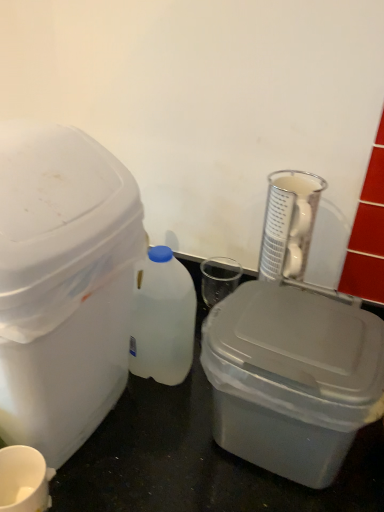
Question: From a real-world perspective, is white matte cup at lower left above or below clear glass beaker at upper right?

Choices:
 (A) below
 (B) above

Answer: (A)

Question: From the image's perspective, is white matte cup at lower left positioned above or below clear glass beaker at upper right?

Choices:
 (A) above
 (B) below

Answer: (B)

Question: Estimate the real-world distances between objects in this image. Which object is farther from the white plastic bottle at center?

Choices:
 (A) gray plastic storage box at center, positioned as the 2th storage box in left-to-right order
 (B) white matte cup at lower left
 (C) white plastic storage box at left, marked as the 2th storage box in a right-to-left arrangement
 (D) clear glass beaker at upper right

Answer: (B)

Question: Which object is the closest to the white matte cup at lower left?

Choices:
 (A) clear glass beaker at upper right
 (B) gray plastic storage box at center, which is counted as the 1th storage box, starting from the right
 (C) white plastic bottle at center
 (D) white plastic storage box at left, marked as the 2th storage box in a right-to-left arrangement

Answer: (D)